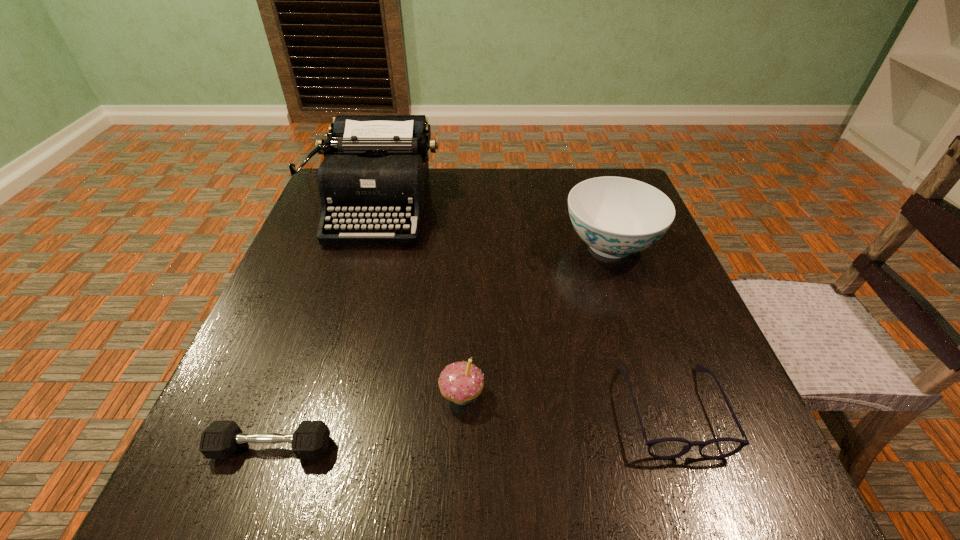
Locate an element on the screen. This screenshot has height=540, width=960. object that is positioned at the near right corner is located at coordinates (664, 448).

The image size is (960, 540). In the image, there is a desktop. In order to click on vacant space at the far edge in this screenshot , I will do `click(486, 184)`.

I want to click on vacant space at the near edge, so click(423, 457).

This screenshot has width=960, height=540. In the image, there is a desktop. Identify the location of free space at the left edge. (277, 406).

Where is `vacant space at the right edge`? vacant space at the right edge is located at coordinates (x=658, y=279).

Locate an element on the screen. The image size is (960, 540). vacant space at the far right corner is located at coordinates (602, 170).

The image size is (960, 540). What are the coordinates of `free point between the spectacles and the third object from right to left` in the screenshot? It's located at (566, 402).

Locate an element on the screen. Image resolution: width=960 pixels, height=540 pixels. free space between the chinaware and the cupcake is located at coordinates (536, 320).

Find the location of `free space between the spectacles and the chinaware`. free space between the spectacles and the chinaware is located at coordinates (641, 327).

Find the location of a particular element. The width and height of the screenshot is (960, 540). vacant point located between the cupcake and the dumbbell is located at coordinates tap(367, 421).